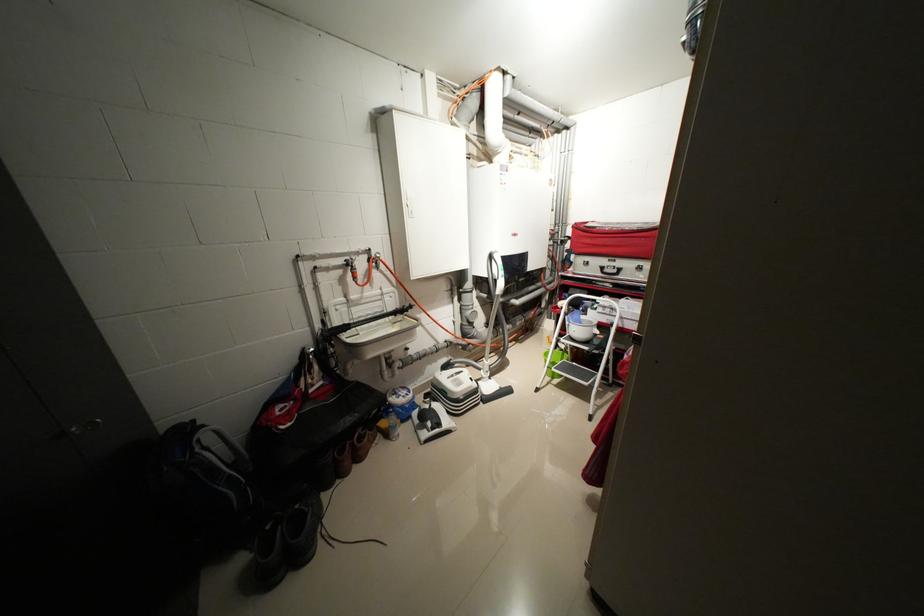
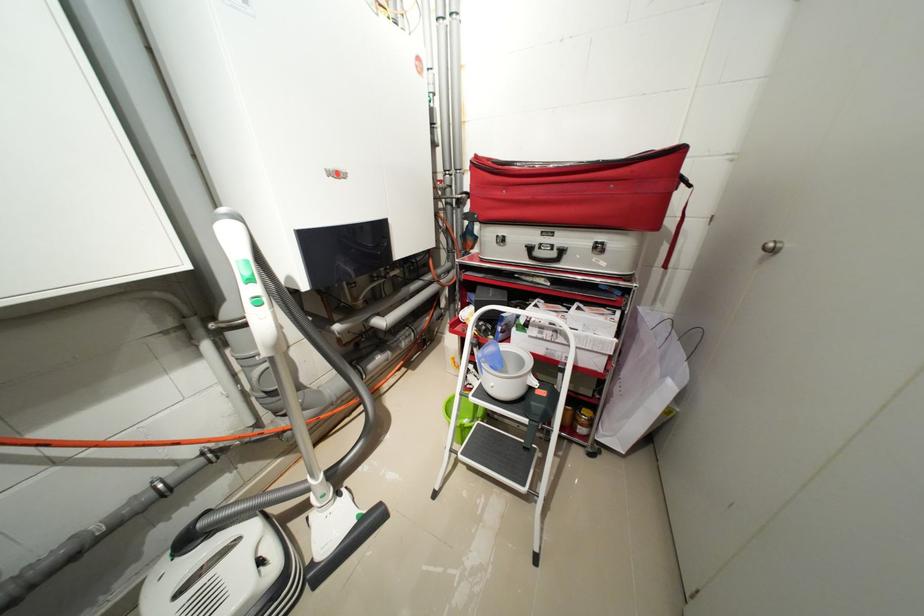
The images are taken continuously from a first-person perspective. In which direction are you moving?

The cameraman moved toward right, forward.